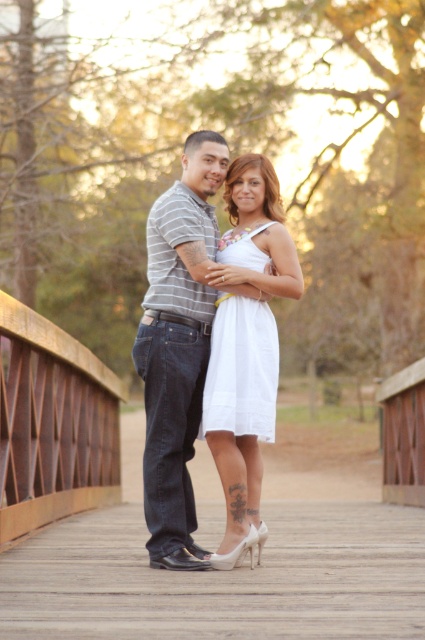
Can you confirm if white satin dress at center is wider than brown wooden bridge at lower left?

Indeed, white satin dress at center has a greater width compared to brown wooden bridge at lower left.

Who is positioned more to the left, white satin dress at center or brown wooden bridge at lower left?

brown wooden bridge at lower left

Find the location of `white satin dress at center`. white satin dress at center is located at coordinates (240, 416).

Can you confirm if striped cotton shirt at center is smaller than brown wooden bridge at lower left?

Yes.

Is striped cotton shirt at center above brown wooden bridge at lower left?

Yes.

Is point (147, 458) positioned after point (79, 472)?

No, (147, 458) is closer to viewer.

Identify the location of striped cotton shirt at center. (178, 348).

Which is below, striped cotton shirt at center or white satin dress at center?

white satin dress at center is lower down.

In the scene shown: Does striped cotton shirt at center come behind white satin dress at center?

No, striped cotton shirt at center is closer to the viewer.

This screenshot has height=640, width=425. Describe the element at coordinates (178, 348) in the screenshot. I see `striped cotton shirt at center` at that location.

This screenshot has height=640, width=425. In order to click on striped cotton shirt at center in this screenshot , I will do `click(178, 348)`.